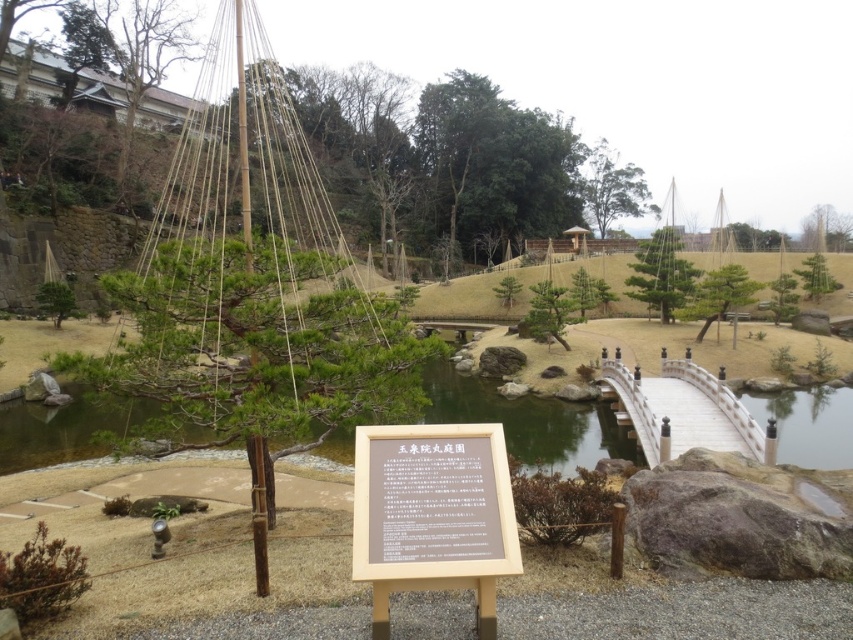
Locate an element on the screen. This screenshot has width=853, height=640. green stone pond at center is located at coordinates (527, 420).

Is point (42, 419) in front of point (654, 401)?

No, it is behind (654, 401).

I want to click on green stone pond at center, so click(x=527, y=420).

Who is lower down, brown wooden sign at center or white wooden bridge at center?

Positioned lower is white wooden bridge at center.

Is brown wooden sign at center below white wooden bridge at center?

No, brown wooden sign at center is not below white wooden bridge at center.

Is point (409, 483) positioned before point (701, 376)?

Yes, it is.

Where is `brown wooden sign at center`? This screenshot has width=853, height=640. brown wooden sign at center is located at coordinates (432, 502).

The image size is (853, 640). What do you see at coordinates (527, 420) in the screenshot? I see `green stone pond at center` at bounding box center [527, 420].

Image resolution: width=853 pixels, height=640 pixels. Describe the element at coordinates (527, 420) in the screenshot. I see `green stone pond at center` at that location.

Identify the location of green stone pond at center. (527, 420).